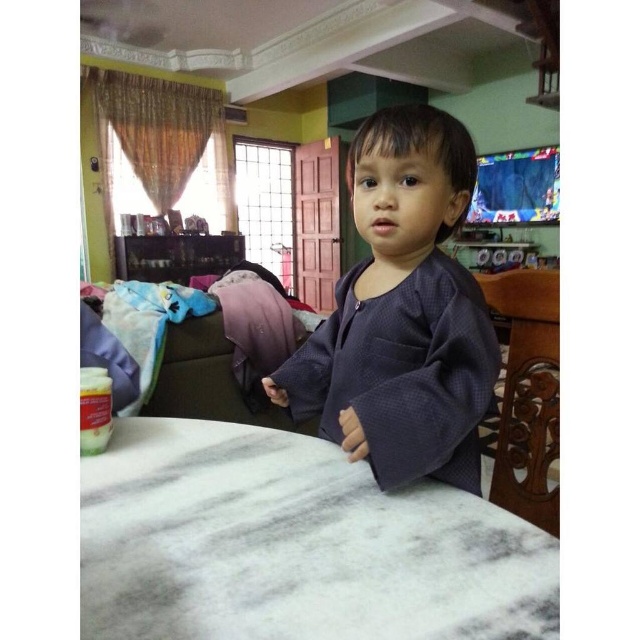
Question: Does dark grey textured robe at center have a greater width compared to carved wood chair at right?

Choices:
 (A) no
 (B) yes

Answer: (B)

Question: Can you confirm if white marble table at center is wider than dark grey textured robe at center?

Choices:
 (A) no
 (B) yes

Answer: (B)

Question: Which object is closer to the camera taking this photo?

Choices:
 (A) carved wood chair at right
 (B) white marble table at center
 (C) dark grey textured robe at center

Answer: (B)

Question: Which of the following is the farthest from the observer?

Choices:
 (A) (x=401, y=300)
 (B) (x=552, y=408)

Answer: (B)

Question: Which object is positioned farthest from the white marble table at center?

Choices:
 (A) carved wood chair at right
 (B) dark grey textured robe at center

Answer: (A)

Question: From the image, what is the correct spatial relationship of dark grey textured robe at center in relation to carved wood chair at right?

Choices:
 (A) above
 (B) below

Answer: (A)